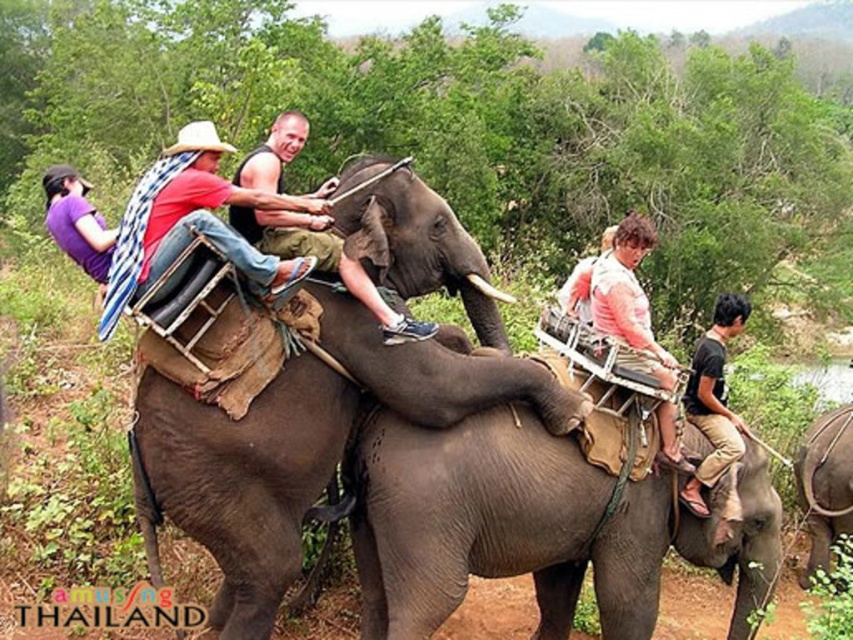
Question: Estimate the real-world distances between objects in this image. Which object is farther from the gray textured elephant at center?

Choices:
 (A) gray textured elephant at lower right
 (B) purple fabric at upper left
 (C) smooth brown skin at center
 (D) gray matte elephant at center

Answer: (A)

Question: Which point appears closest to the camera in this image?

Choices:
 (A) (86, 221)
 (B) (164, 508)
 (C) (480, 538)

Answer: (B)

Question: Does gray textured elephant at center have a greater width compared to gray textured elephant at lower right?

Choices:
 (A) yes
 (B) no

Answer: (A)

Question: Is gray matte elephant at center positioned before gray textured elephant at lower right?

Choices:
 (A) yes
 (B) no

Answer: (A)

Question: Which is nearer to the gray textured elephant at center?

Choices:
 (A) smooth brown skin at center
 (B) purple fabric at upper left

Answer: (A)

Question: Does smooth brown skin at center appear under purple fabric at upper left?

Choices:
 (A) yes
 (B) no

Answer: (A)